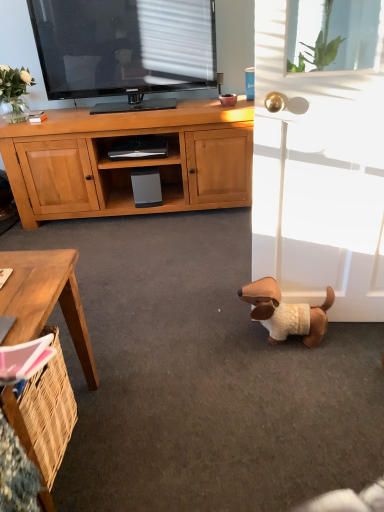
Find the location of a particular element. The height and width of the screenshot is (512, 384). free region on the left part of white matte screen door at lower right is located at coordinates coord(226,331).